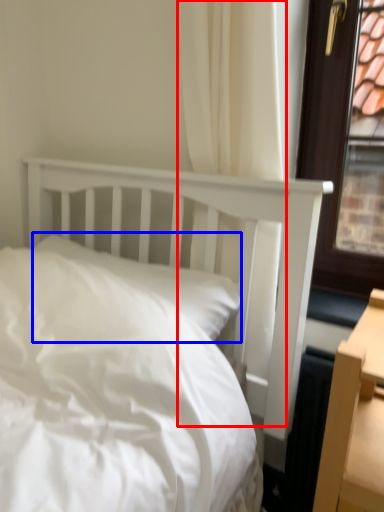
Question: Which object is further to the camera taking this photo, curtain (highlighted by a red box) or pillow (highlighted by a blue box)?

Choices:
 (A) curtain
 (B) pillow

Answer: (B)